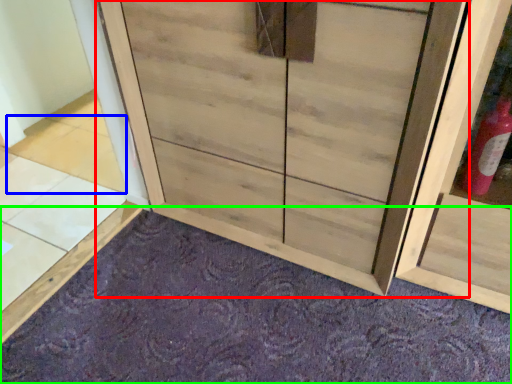
Question: Based on their relative distances, which object is nearer to cupboard (highlighted by a red box)? Choose from tile (highlighted by a blue box) and plain (highlighted by a green box).

Choices:
 (A) tile
 (B) plain

Answer: (B)